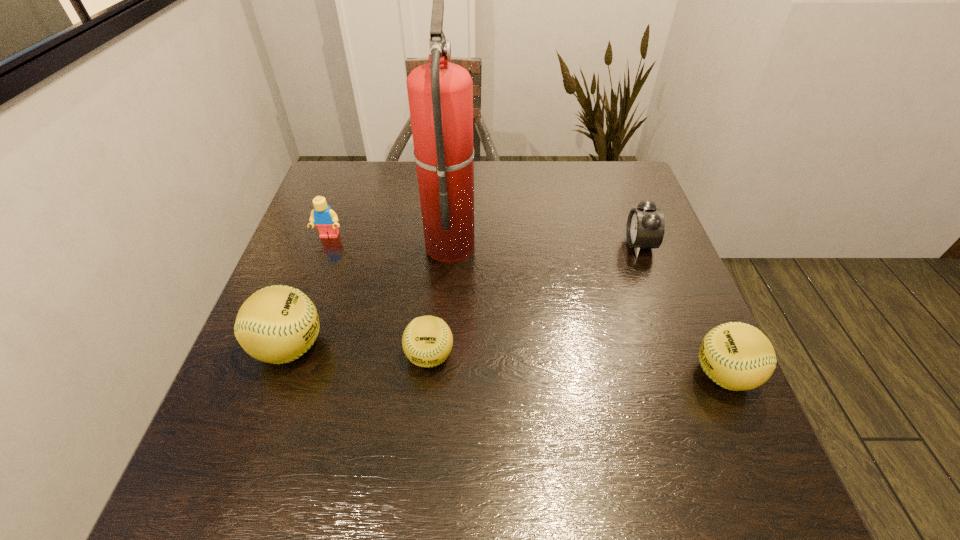
Where is `softball present at the right edge`? This screenshot has width=960, height=540. softball present at the right edge is located at coordinates (737, 356).

Where is `alarm clock that is positioned at the right edge`? alarm clock that is positioned at the right edge is located at coordinates (645, 228).

What are the coordinates of `object that is at the near right corner` in the screenshot? It's located at (737, 356).

The height and width of the screenshot is (540, 960). Identify the location of vacant space at the far edge of the desktop. (478, 196).

Locate an element on the screen. This screenshot has width=960, height=540. vacant space at the left edge is located at coordinates (300, 260).

This screenshot has height=540, width=960. I want to click on free space at the right edge of the desktop, so click(605, 211).

In order to click on free space at the far left corner of the desktop in this screenshot , I will do `click(372, 162)`.

At what (x,y) coordinates should I click in order to perform the action: click on empty space that is in between the shortest softball and the second shortest softball. Please return your answer as a coordinate pair (x, y). Image resolution: width=960 pixels, height=540 pixels. Looking at the image, I should click on (577, 365).

Where is `free space between the rightmost softball and the fire extinguisher`? free space between the rightmost softball and the fire extinguisher is located at coordinates (587, 309).

You are a GUI agent. You are given a task and a screenshot of the screen. Output one action in this format:
    pyautogui.click(x=<x>, y=<y>)
    Task: Click on the blank region between the tallest object and the rightmost softball
    The width and height of the screenshot is (960, 540).
    Given the screenshot: What is the action you would take?
    pyautogui.click(x=587, y=309)